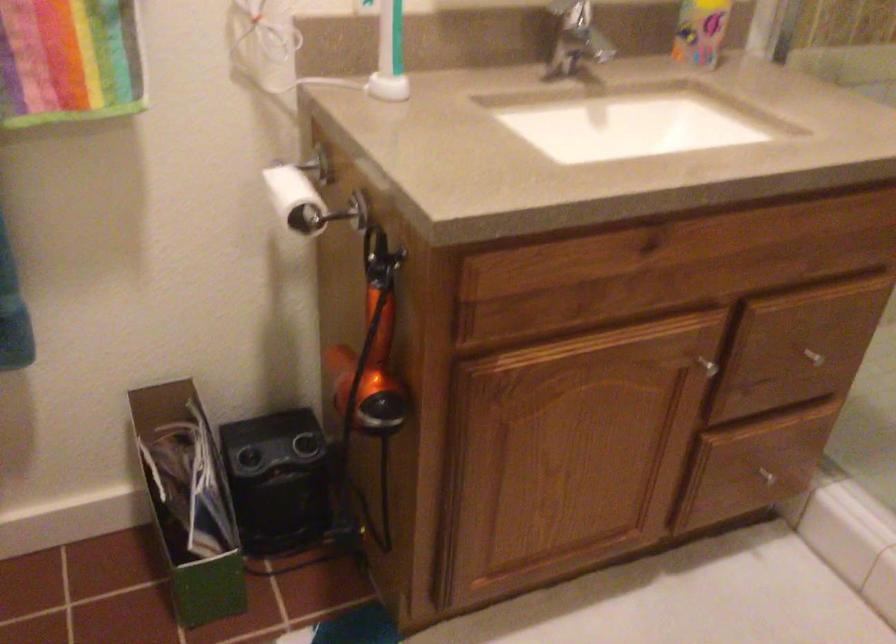
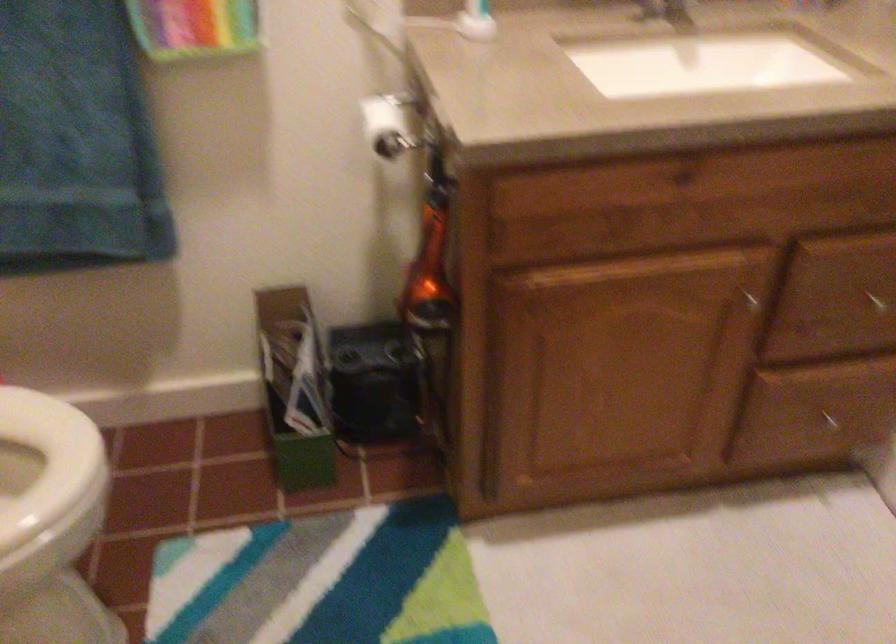
Find the pixel in the second image that matches point 304,198 in the first image.

(388, 125)